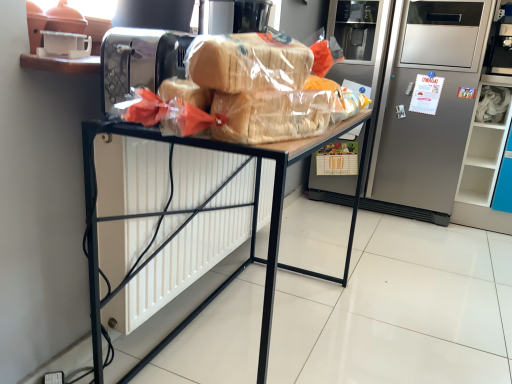
What are the coordinates of `empty space that is ontop of translucent plastic bread at center (from a real-world perspective)` in the screenshot? It's located at (265, 89).